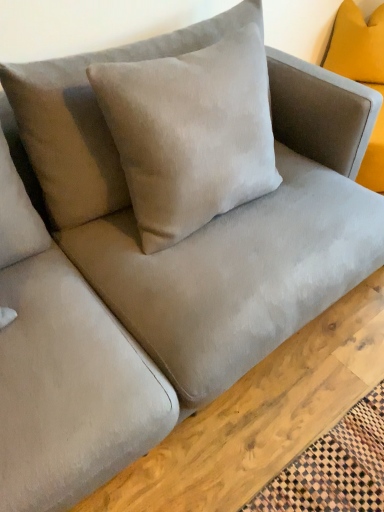
Question: Based on their positions, is suede-like beige pillow at center, placed as the first pillow when sorted from left to right, located to the left or right of mustard velvet pillow at upper right, which ranks as the first pillow in right-to-left order?

Choices:
 (A) left
 (B) right

Answer: (A)

Question: From the image's perspective, is suede-like beige pillow at center, positioned as the 1th pillow in bottom-to-top order, above or below mustard velvet pillow at upper right, which ranks as the first pillow in right-to-left order?

Choices:
 (A) below
 (B) above

Answer: (A)

Question: Which of these objects is positioned farthest from the mustard velvet pillow at upper right, which appears as the 2th pillow when viewed from the left?

Choices:
 (A) matte gray couch at center
 (B) suede-like beige pillow at center, placed as the first pillow when sorted from left to right

Answer: (A)

Question: Estimate the real-world distances between objects in this image. Which object is farther from the mustard velvet pillow at upper right, arranged as the second pillow when ordered from the bottom?

Choices:
 (A) suede-like beige pillow at center, positioned as the 1th pillow in front-to-back order
 (B) matte gray couch at center

Answer: (B)